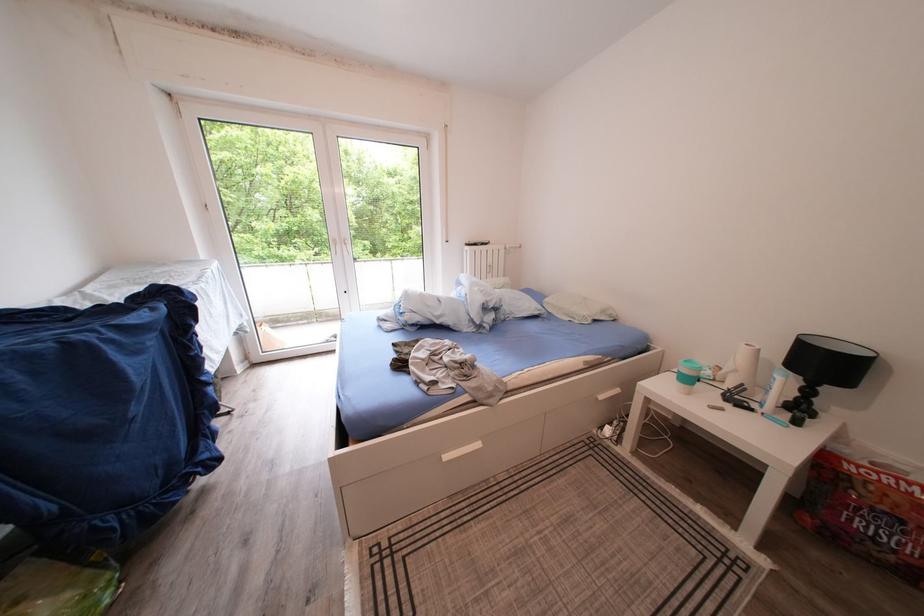
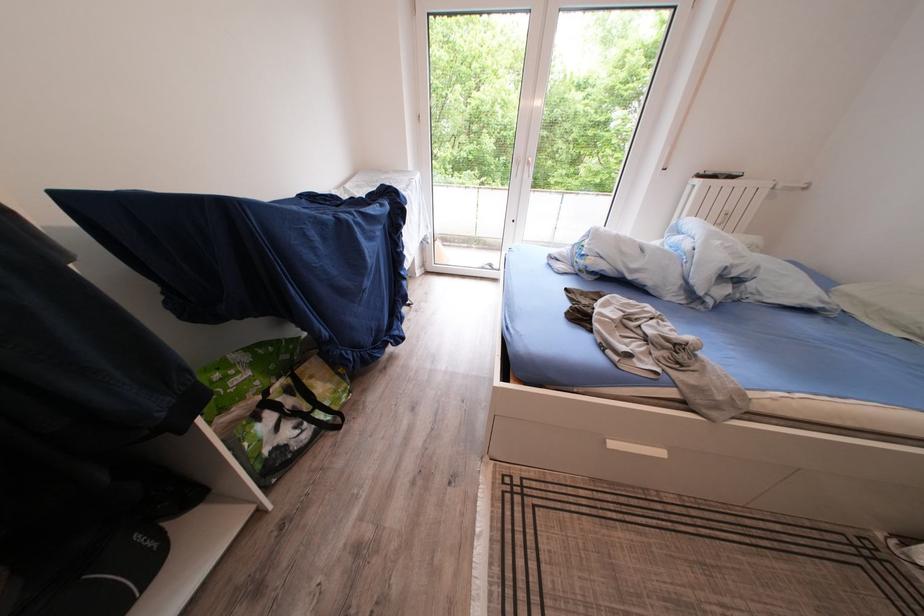
Locate, in the second image, the point that corresponds to (x=455, y=463) in the first image.

(621, 450)